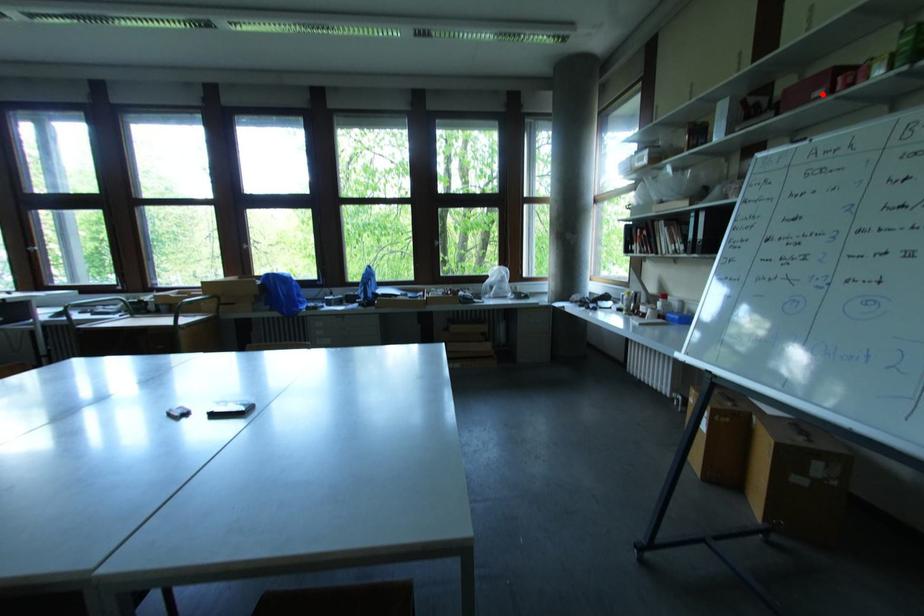
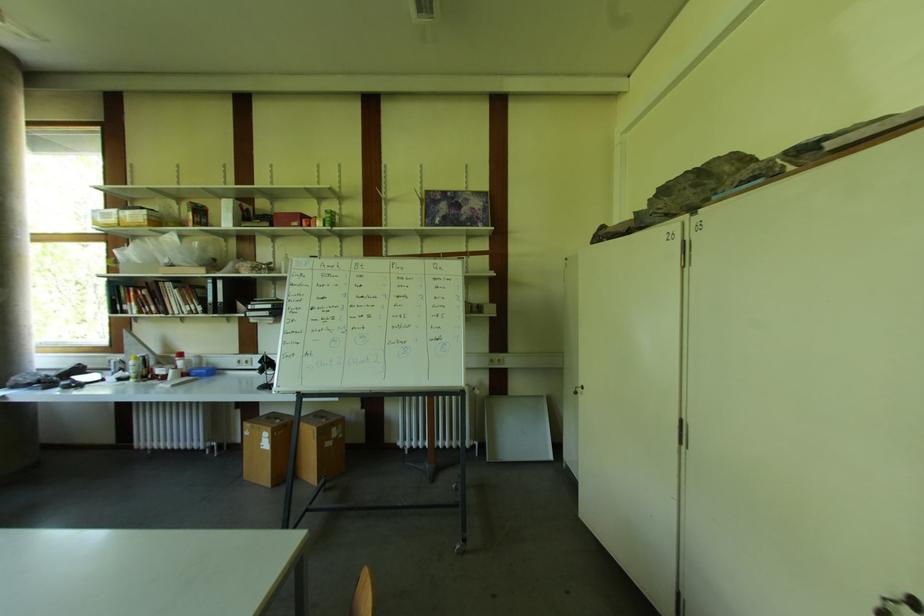
Find the pixel in the second image that matches the highlighted location in the first image.

(298, 225)